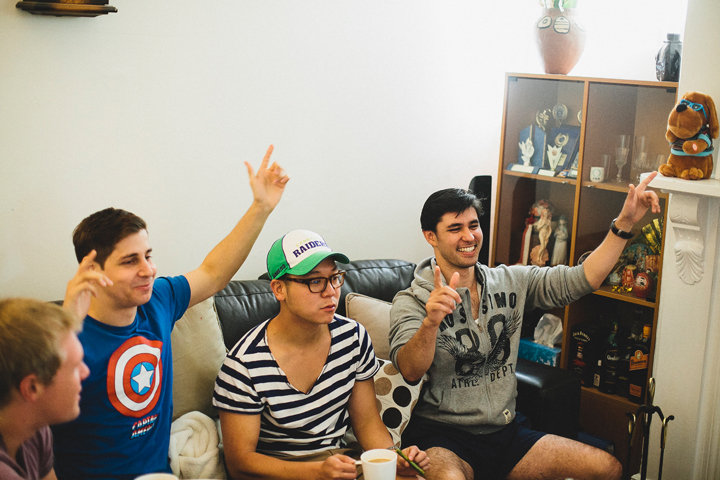
The image size is (720, 480). Identify the location of cabinet. (623, 110), (598, 421).